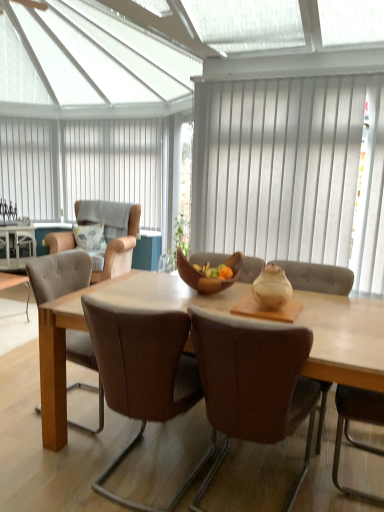
The height and width of the screenshot is (512, 384). I want to click on free space to the left of brown leather chair at left, the third chair viewed from the front, so click(19, 402).